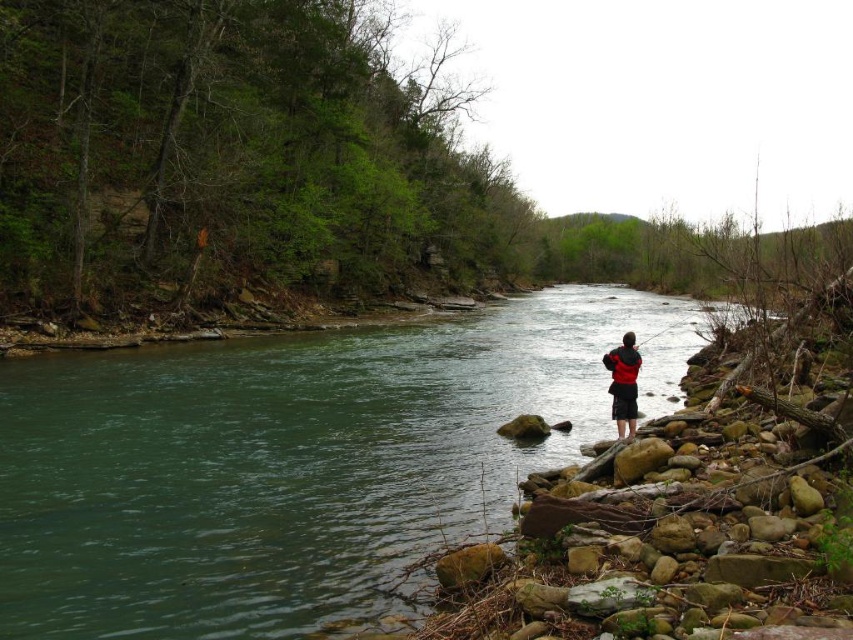
Question: Among these objects, which one is nearest to the camera?

Choices:
 (A) green smooth water at center
 (B) red fabric jacket at center

Answer: (A)

Question: Is green smooth water at center smaller than red fabric jacket at center?

Choices:
 (A) no
 (B) yes

Answer: (A)

Question: Does green smooth water at center have a greater width compared to red fabric jacket at center?

Choices:
 (A) yes
 (B) no

Answer: (A)

Question: Which point is closer to the camera taking this photo?

Choices:
 (A) (625, 348)
 (B) (48, 486)

Answer: (B)

Question: Can you confirm if green smooth water at center is positioned above red fabric jacket at center?

Choices:
 (A) no
 (B) yes

Answer: (B)